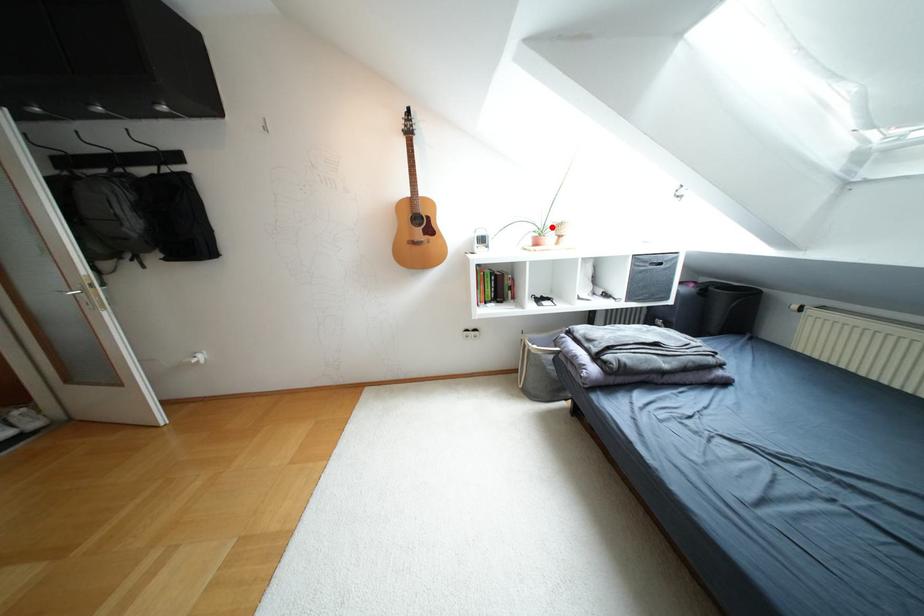
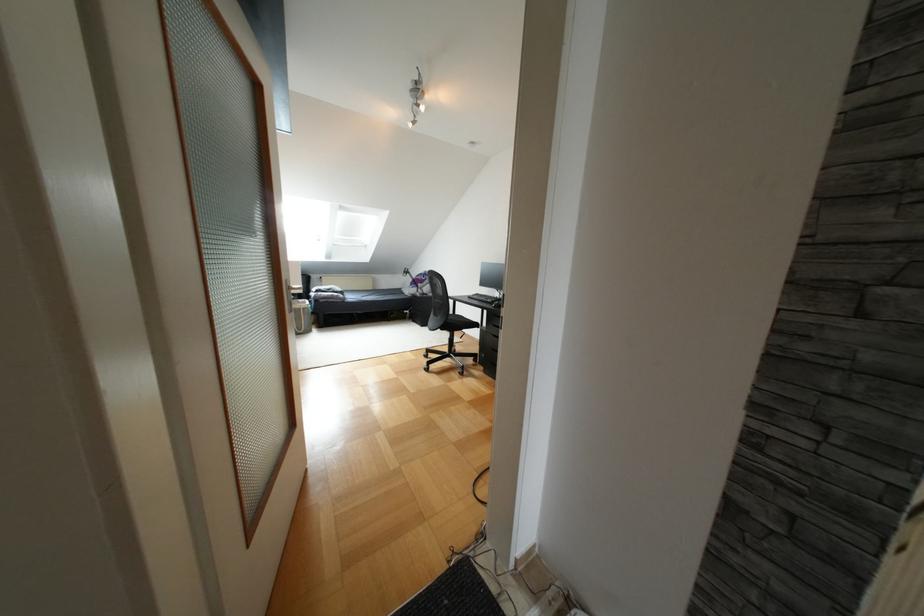
Question: I am providing you with two images of the same scene from different viewpoints. A red point is marked on the first image. Can you still see the location of the red point in image 2?

Choices:
 (A) Yes
 (B) No

Answer: (B)